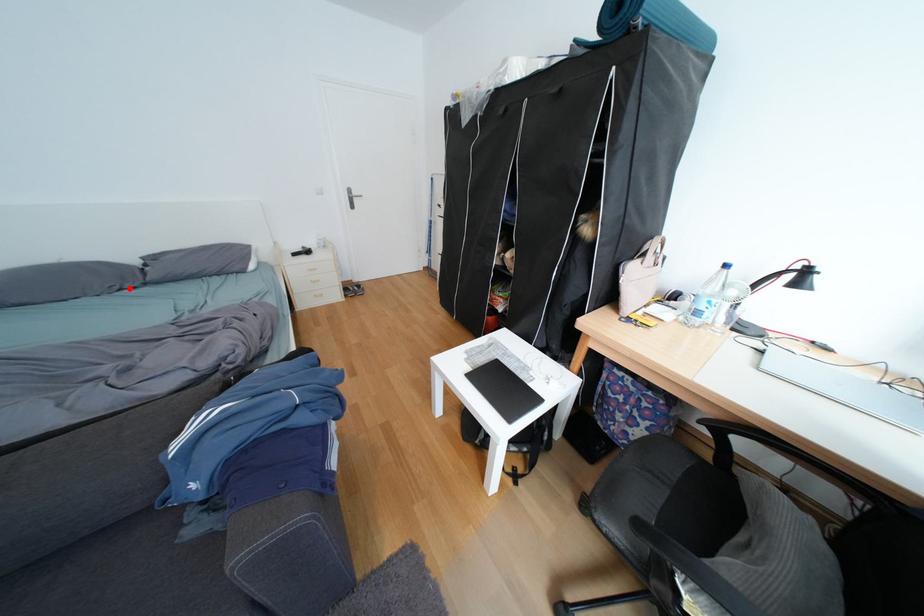
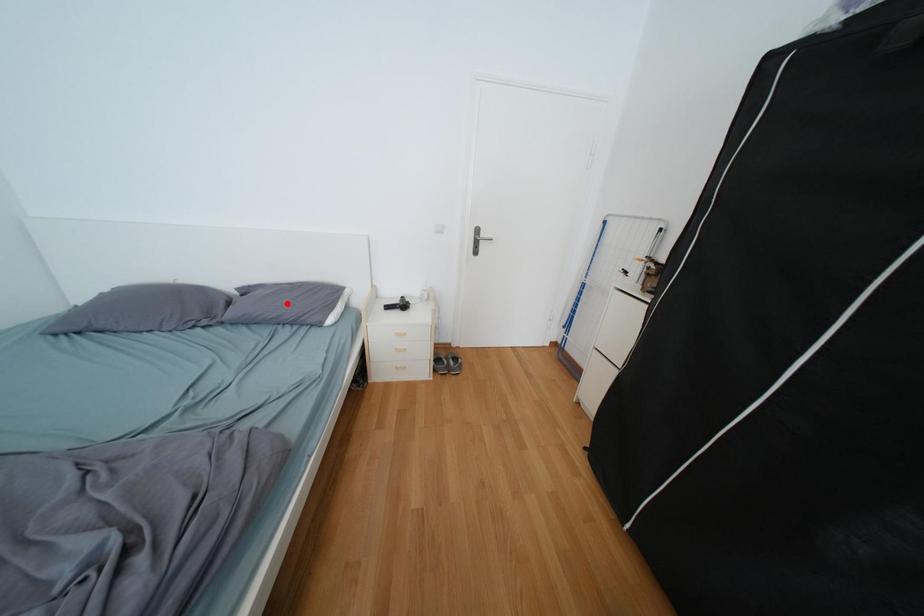
I am providing you with two images of the same scene from different viewpoints. A red point is marked on the first image and another point is marked on the second image. Do the highlighted points in image1 and image2 indicate the same real-world spot?

No